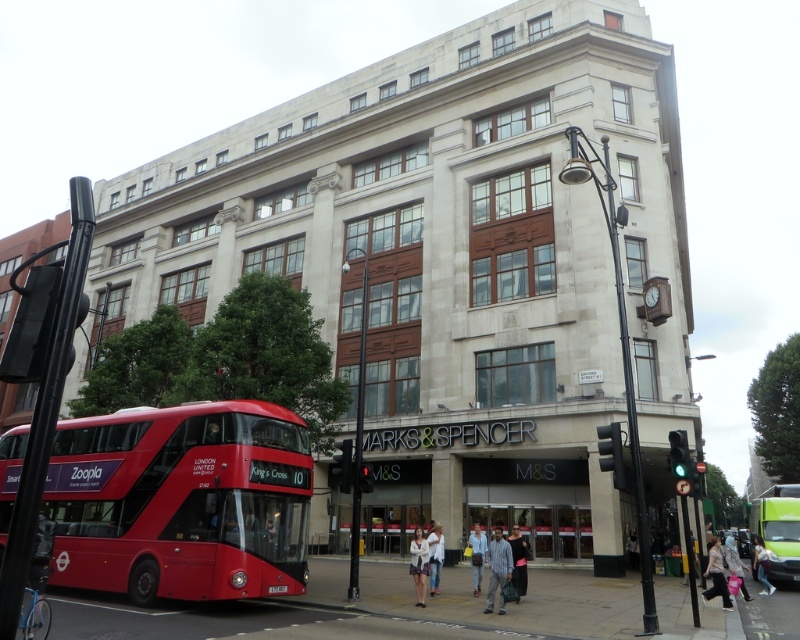
Can you confirm if light blue jeans at center is positioned below light blue denim jeans at center?

Indeed, light blue jeans at center is positioned under light blue denim jeans at center.

Who is more forward, (480,538) or (438,589)?

Point (438,589)

Which is in front, point (480, 552) or point (433, 564)?

Point (433, 564)

Locate an element on the screen. light blue jeans at center is located at coordinates (478, 556).

Is red matte bus at center wider than denim jacket at lower right?

Indeed, red matte bus at center has a greater width compared to denim jacket at lower right.

Can you confirm if red matte bus at center is shorter than denim jacket at lower right?

No.

The height and width of the screenshot is (640, 800). Identify the location of red matte bus at center. (778, 529).

Between point (792, 486) and point (474, 547), which one is positioned in front?

Point (474, 547) is in front.

Can you confirm if red matte bus at center is taller than light blue jeans at center?

Indeed, red matte bus at center has a greater height compared to light blue jeans at center.

You are a GUI agent. You are given a task and a screenshot of the screen. Output one action in this format:
    pyautogui.click(x=<x>, y=<y>)
    Task: Click on the red matte bus at center
    The width and height of the screenshot is (800, 640).
    Given the screenshot: What is the action you would take?
    pyautogui.click(x=778, y=529)